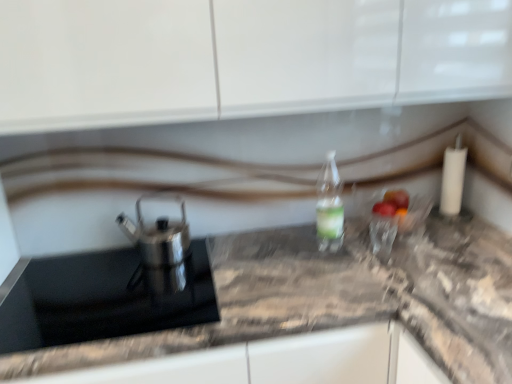
Question: From a real-world perspective, does clear plastic bottle at center stand above satin silver teapot at left?

Choices:
 (A) no
 (B) yes

Answer: (B)

Question: Can you confirm if clear plastic bottle at center is positioned to the right of satin silver teapot at left?

Choices:
 (A) yes
 (B) no

Answer: (A)

Question: Is clear plastic bottle at center further to the viewer compared to satin silver teapot at left?

Choices:
 (A) no
 (B) yes

Answer: (B)

Question: Is clear plastic bottle at center not close to satin silver teapot at left?

Choices:
 (A) yes
 (B) no

Answer: (B)

Question: Can you confirm if clear plastic bottle at center is shorter than satin silver teapot at left?

Choices:
 (A) yes
 (B) no

Answer: (B)

Question: From the image's perspective, is clear plastic bottle at center above or below black glass sink at left?

Choices:
 (A) below
 (B) above

Answer: (B)

Question: Is clear plastic bottle at center in front of or behind black glass sink at left in the image?

Choices:
 (A) front
 (B) behind

Answer: (B)

Question: In terms of width, does clear plastic bottle at center look wider or thinner when compared to black glass sink at left?

Choices:
 (A) thin
 (B) wide

Answer: (A)

Question: Considering the positions of clear plastic bottle at center and black glass sink at left in the image, is clear plastic bottle at center taller or shorter than black glass sink at left?

Choices:
 (A) tall
 (B) short

Answer: (A)

Question: Would you say marble gray countertop at center is to the left or to the right of black glass sink at left in the picture?

Choices:
 (A) left
 (B) right

Answer: (B)

Question: From the image's perspective, is marble gray countertop at center above or below black glass sink at left?

Choices:
 (A) below
 (B) above

Answer: (A)

Question: Relative to black glass sink at left, is marble gray countertop at center in front or behind?

Choices:
 (A) front
 (B) behind

Answer: (A)

Question: From a real-world perspective, relative to black glass sink at left, is marble gray countertop at center vertically above or below?

Choices:
 (A) above
 (B) below

Answer: (B)

Question: In terms of size, does satin silver teapot at left appear bigger or smaller than clear plastic bottle at center?

Choices:
 (A) big
 (B) small

Answer: (A)

Question: In the image, is satin silver teapot at left positioned in front of or behind clear plastic bottle at center?

Choices:
 (A) front
 (B) behind

Answer: (A)